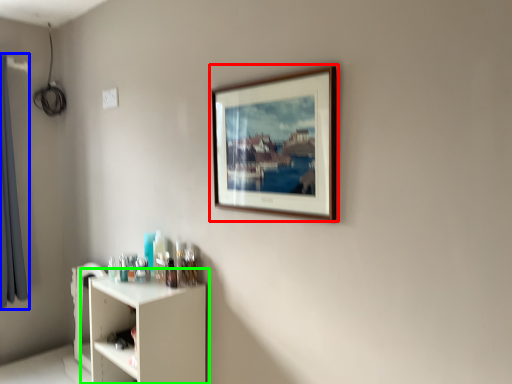
Question: Which object is positioned farthest from picture frame (highlighted by a red box)? Select from curtain (highlighted by a blue box) and shelf (highlighted by a green box).

Choices:
 (A) curtain
 (B) shelf

Answer: (A)